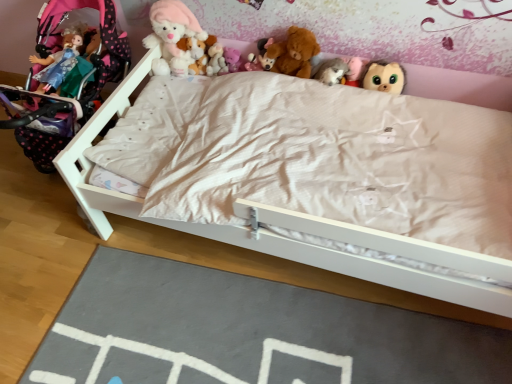
Question: Based on their sizes in the image, would you say fluffy pink teddy bear at upper center, positioned as the second toy in right-to-left order, is bigger or smaller than fluffy plush toys at upper center?

Choices:
 (A) small
 (B) big

Answer: (A)

Question: In the image, is fluffy pink teddy bear at upper center, positioned as the second toy in right-to-left order, on the left side or the right side of fluffy plush toys at upper center?

Choices:
 (A) left
 (B) right

Answer: (B)

Question: Which object is positioned closest to the fluffy plush toys at center, which is the second toy from left to right?

Choices:
 (A) matte pink teddy bear at upper center, the third toy positioned from the left
 (B) fluffy brown plush at upper center, the first toy when ordered from right to left
 (C) fluffy pink teddy bear at upper center, positioned as the second toy in right-to-left order
 (D) pink polka dot baby carriage at left
 (E) brown plush bear at upper center, arranged as the fourth toy when viewed from the right

Answer: (A)

Question: Which object is positioned closest to the slate at lower center?

Choices:
 (A) matte pink teddy bear at upper center, the third toy positioned from the left
 (B) fluffy plush toys at center, which is the second toy from left to right
 (C) fuzzy gray cat at upper center, which is the third toy in right-to-left order
 (D) pink polka dot baby carriage at left
 (E) fluffy pink teddy bear at upper center, which is counted as the 7th toy, starting from the left

Answer: (D)